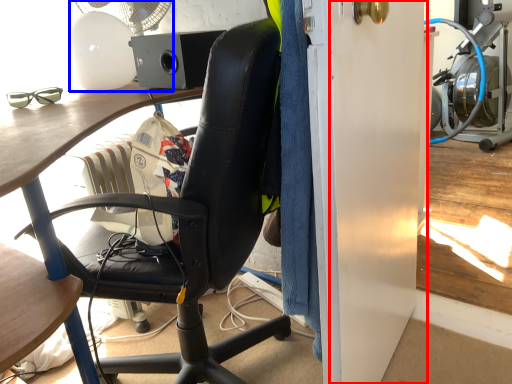
Question: Among these objects, which one is farthest to the camera, screen door (highlighted by a red box) or mechanical fan (highlighted by a blue box)?

Choices:
 (A) screen door
 (B) mechanical fan

Answer: (B)